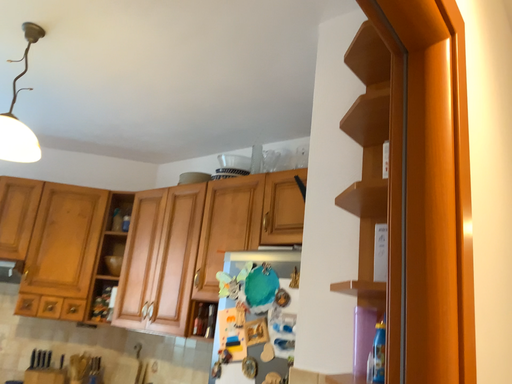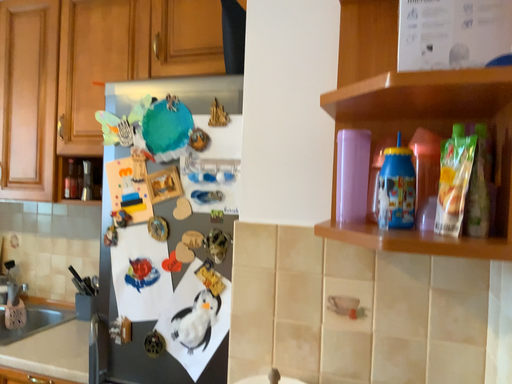
Question: Which way did the camera rotate in the video?

Choices:
 (A) rotated right
 (B) rotated left

Answer: (A)